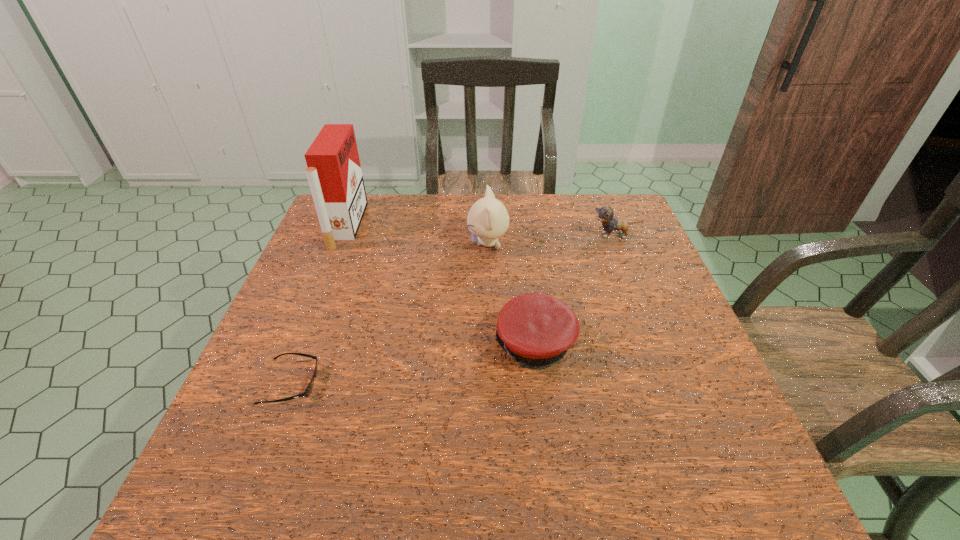
Locate an element on the screen. sunglasses situated at the left edge is located at coordinates (307, 392).

Find the location of a particular element. This screenshot has height=540, width=960. object present at the right edge is located at coordinates (605, 214).

Locate an element on the screen. The image size is (960, 540). object that is at the far left corner is located at coordinates (334, 173).

The width and height of the screenshot is (960, 540). Find the location of `object present at the far right corner`. object present at the far right corner is located at coordinates 605,214.

Locate an element on the screen. This screenshot has height=540, width=960. vacant region at the far edge of the desktop is located at coordinates (405, 198).

Where is `vacant point at the near edge`? vacant point at the near edge is located at coordinates (564, 462).

Where is `vacant area at the left edge of the desktop`? Image resolution: width=960 pixels, height=540 pixels. vacant area at the left edge of the desktop is located at coordinates (291, 322).

In order to click on vacant space at the right edge of the desktop in this screenshot , I will do `click(693, 372)`.

What are the coordinates of `vacant space at the far left corner of the desktop` in the screenshot? It's located at (363, 226).

Where is `vacant space at the far right corner of the desktop`? The image size is (960, 540). vacant space at the far right corner of the desktop is located at coordinates (627, 201).